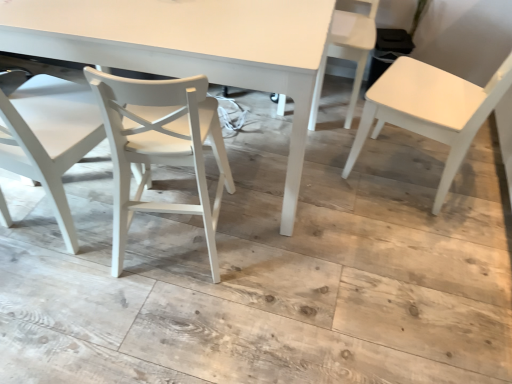
Locate an element on the screen. The height and width of the screenshot is (384, 512). white matte chair at center, marked as the second chair in a left-to-right arrangement is located at coordinates (160, 147).

The height and width of the screenshot is (384, 512). Describe the element at coordinates (160, 147) in the screenshot. I see `white matte chair at center, marked as the second chair in a left-to-right arrangement` at that location.

The height and width of the screenshot is (384, 512). What do you see at coordinates (347, 53) in the screenshot?
I see `white plastic chair at upper right, the 2th chair from the right` at bounding box center [347, 53].

What are the coordinates of `white matte table at center` in the screenshot? It's located at click(189, 47).

This screenshot has height=384, width=512. Identify the location of white matte chair at right, arranged as the 1th chair when viewed from the right. pyautogui.click(x=430, y=110).

This screenshot has width=512, height=384. What do you see at coordinates (430, 110) in the screenshot? I see `white matte chair at right, placed as the fourth chair when sorted from left to right` at bounding box center [430, 110].

At what (x,y) coordinates should I click in order to perform the action: click on white matte chair at left, marked as the first chair in a left-to-right arrangement. Please return your answer as a coordinate pair (x, y). Image resolution: width=512 pixels, height=384 pixels. Looking at the image, I should click on 49,137.

Which object is closer to the camera, white matte chair at left, marked as the first chair in a left-to-right arrangement, or white matte chair at center, marked as the second chair in a left-to-right arrangement?

white matte chair at left, marked as the first chair in a left-to-right arrangement, is more forward.

Consider the image. Does white matte chair at left, which is counted as the fourth chair, starting from the right, have a greater height compared to white matte chair at center, marked as the second chair in a left-to-right arrangement?

Yes, white matte chair at left, which is counted as the fourth chair, starting from the right, is taller than white matte chair at center, marked as the second chair in a left-to-right arrangement.

Can we say white matte chair at left, marked as the first chair in a left-to-right arrangement, lies outside white matte chair at center, acting as the 3th chair starting from the right?

white matte chair at left, marked as the first chair in a left-to-right arrangement, is positioned outside white matte chair at center, acting as the 3th chair starting from the right.

Between white matte chair at left, which is counted as the fourth chair, starting from the right, and white matte chair at center, acting as the 3th chair starting from the right, which one has larger width?

white matte chair at left, which is counted as the fourth chair, starting from the right.

Is white matte table at center at the back of white matte chair at center, marked as the second chair in a left-to-right arrangement?

white matte chair at center, marked as the second chair in a left-to-right arrangement, is not turned away from white matte table at center.

Considering the points (206, 205) and (175, 23), which point is behind, point (206, 205) or point (175, 23)?

The point (206, 205) is behind.

Which of these two, white matte chair at center, marked as the second chair in a left-to-right arrangement, or white matte table at center, is thinner?

With smaller width is white matte chair at center, marked as the second chair in a left-to-right arrangement.

Is white matte chair at center, acting as the 3th chair starting from the right, closer to the viewer compared to white matte table at center?

Yes, it is.

Is white matte table at center positioned with its back to white matte chair at right, placed as the fourth chair when sorted from left to right?

No, white matte table at center is not facing the opposite direction of white matte chair at right, placed as the fourth chair when sorted from left to right.

Identify the location of chair that is the 3rd one when counting rightward from the white matte table at center. (430, 110).

Measure the distance between white matte table at center and white matte chair at right, arranged as the 1th chair when viewed from the right.

white matte table at center is 26.00 inches away from white matte chair at right, arranged as the 1th chair when viewed from the right.

Considering the sizes of objects white matte table at center and white matte chair at right, placed as the fourth chair when sorted from left to right, in the image provided, who is shorter, white matte table at center or white matte chair at right, placed as the fourth chair when sorted from left to right,?

Standing shorter between the two is white matte table at center.

Does white matte chair at right, placed as the fourth chair when sorted from left to right, have a larger size compared to white plastic chair at upper right, the third chair positioned from the left?

Indeed, white matte chair at right, placed as the fourth chair when sorted from left to right, has a larger size compared to white plastic chair at upper right, the third chair positioned from the left.

From a real-world perspective, is white matte chair at right, arranged as the 1th chair when viewed from the right, below white plastic chair at upper right, the third chair positioned from the left?

No.

From the image's perspective, is white matte chair at right, placed as the fourth chair when sorted from left to right, positioned above or below white plastic chair at upper right, the 2th chair from the right?

Based on their image positions, white matte chair at right, placed as the fourth chair when sorted from left to right, is located beneath white plastic chair at upper right, the 2th chair from the right.

Is white matte chair at right, arranged as the 1th chair when viewed from the right, taller or shorter than white plastic chair at upper right, the 2th chair from the right?

Clearly, white matte chair at right, arranged as the 1th chair when viewed from the right, is taller compared to white plastic chair at upper right, the 2th chair from the right.

Can you confirm if white plastic chair at upper right, the third chair positioned from the left, is positioned to the right of white matte chair at center, acting as the 3th chair starting from the right?

Yes.

From the image's perspective, is white plastic chair at upper right, the 2th chair from the right, on white matte chair at center, acting as the 3th chair starting from the right?

Yes, from the image's perspective, white plastic chair at upper right, the 2th chair from the right, is above white matte chair at center, acting as the 3th chair starting from the right.

What's the angular difference between white plastic chair at upper right, the 2th chair from the right, and white matte chair at center, acting as the 3th chair starting from the right,'s facing directions?

168 degrees separate the facing orientations of white plastic chair at upper right, the 2th chair from the right, and white matte chair at center, acting as the 3th chair starting from the right.

Is point (364, 63) positioned behind point (113, 95)?

Yes, point (364, 63) is behind point (113, 95).

How different are the orientations of white matte chair at left, marked as the first chair in a left-to-right arrangement, and white matte chair at right, arranged as the 1th chair when viewed from the right, in degrees?

They differ by 82.4 degrees in their facing directions.

From the white matte chair at left, which is counted as the fourth chair, starting from the right, count 3rd chair to the right and point to it. Please provide its 2D coordinates.

[(430, 110)]

Is white matte chair at left, which is counted as the fourth chair, starting from the right, outside of white matte chair at right, placed as the fourth chair when sorted from left to right?

white matte chair at left, which is counted as the fourth chair, starting from the right, lies outside white matte chair at right, placed as the fourth chair when sorted from left to right,'s area.

Considering the sizes of objects white matte chair at left, which is counted as the fourth chair, starting from the right, and white matte chair at right, arranged as the 1th chair when viewed from the right, in the image provided, who is thinner, white matte chair at left, which is counted as the fourth chair, starting from the right, or white matte chair at right, arranged as the 1th chair when viewed from the right,?

white matte chair at left, which is counted as the fourth chair, starting from the right, is thinner.

From the image's perspective, would you say white matte chair at right, arranged as the 1th chair when viewed from the right, is positioned over white matte table at center?

Incorrect, from the image's perspective, white matte chair at right, arranged as the 1th chair when viewed from the right, is lower than white matte table at center.

Is white matte chair at right, placed as the fourth chair when sorted from left to right, looking in the opposite direction of white matte table at center?

No, white matte chair at right, placed as the fourth chair when sorted from left to right,'s orientation is not away from white matte table at center.

From a real-world perspective, is white matte chair at right, placed as the fourth chair when sorted from left to right, physically located above or below white matte table at center?

Clearly, from a real-world perspective, white matte chair at right, placed as the fourth chair when sorted from left to right, is above white matte table at center.

Is white matte chair at right, placed as the fourth chair when sorted from left to right, spatially inside white matte table at center, or outside of it?

The correct answer is: outside.

This screenshot has width=512, height=384. What are the coordinates of `chair that is below the white matte chair at left, marked as the first chair in a left-to-right arrangement (from the image's perspective)` in the screenshot? It's located at 160,147.

Which chair is the 2nd one when counting from the front of the white matte table at center? Please provide its 2D coordinates.

[(160, 147)]

When comparing their distances from white matte table at center, does white matte chair at center, marked as the second chair in a left-to-right arrangement, or white plastic chair at upper right, the third chair positioned from the left, seem closer?

white matte chair at center, marked as the second chair in a left-to-right arrangement, lies closer to white matte table at center than the other object.

When comparing their distances from white plastic chair at upper right, the 2th chair from the right, does white matte chair at center, acting as the 3th chair starting from the right, or white matte chair at right, placed as the fourth chair when sorted from left to right, seem further?

Among the two, white matte chair at center, acting as the 3th chair starting from the right, is located further to white plastic chair at upper right, the 2th chair from the right.

When comparing their distances from white matte chair at right, placed as the fourth chair when sorted from left to right, does white matte chair at center, acting as the 3th chair starting from the right, or white matte table at center seem further?

The object further to white matte chair at right, placed as the fourth chair when sorted from left to right, is white matte chair at center, acting as the 3th chair starting from the right.

Which object lies further to the anchor point white matte chair at left, which is counted as the fourth chair, starting from the right, white matte table at center or white matte chair at right, placed as the fourth chair when sorted from left to right?

Based on the image, white matte chair at right, placed as the fourth chair when sorted from left to right, appears to be further to white matte chair at left, which is counted as the fourth chair, starting from the right.

Estimate the real-world distances between objects in this image. Which object is closer to white plastic chair at upper right, the 2th chair from the right, white matte table at center or white matte chair at right, arranged as the 1th chair when viewed from the right?

Based on the image, white matte chair at right, arranged as the 1th chair when viewed from the right, appears to be nearer to white plastic chair at upper right, the 2th chair from the right.

From the image, which object appears to be farther from white matte chair at left, marked as the first chair in a left-to-right arrangement, white plastic chair at upper right, the third chair positioned from the left, or white matte chair at right, placed as the fourth chair when sorted from left to right?

Among the two, white matte chair at right, placed as the fourth chair when sorted from left to right, is located further to white matte chair at left, marked as the first chair in a left-to-right arrangement.

Estimate the real-world distances between objects in this image. Which object is closer to white matte chair at right, arranged as the 1th chair when viewed from the right, white matte chair at left, marked as the first chair in a left-to-right arrangement, or white matte chair at center, marked as the second chair in a left-to-right arrangement?

The object closer to white matte chair at right, arranged as the 1th chair when viewed from the right, is white matte chair at center, marked as the second chair in a left-to-right arrangement.

Considering their positions, is white matte chair at left, which is counted as the fourth chair, starting from the right, positioned closer to white matte chair at center, marked as the second chair in a left-to-right arrangement, than white plastic chair at upper right, the 2th chair from the right?

The object closer to white matte chair at center, marked as the second chair in a left-to-right arrangement, is white matte chair at left, which is counted as the fourth chair, starting from the right.

Image resolution: width=512 pixels, height=384 pixels. In order to click on chair between white matte chair at center, acting as the 3th chair starting from the right, and white matte chair at right, placed as the fourth chair when sorted from left to right, from left to right in this screenshot , I will do `click(347, 53)`.

The height and width of the screenshot is (384, 512). What are the coordinates of `table positioned between white matte chair at center, marked as the second chair in a left-to-right arrangement, and white plastic chair at upper right, the third chair positioned from the left, from near to far` in the screenshot? It's located at (189, 47).

Identify the location of table between white matte chair at left, marked as the first chair in a left-to-right arrangement, and white plastic chair at upper right, the third chair positioned from the left, in the horizontal direction. (189, 47).

Locate an element on the screen. This screenshot has width=512, height=384. table between white matte chair at left, marked as the first chair in a left-to-right arrangement, and white matte chair at center, marked as the second chair in a left-to-right arrangement, from left to right is located at coordinates (189, 47).